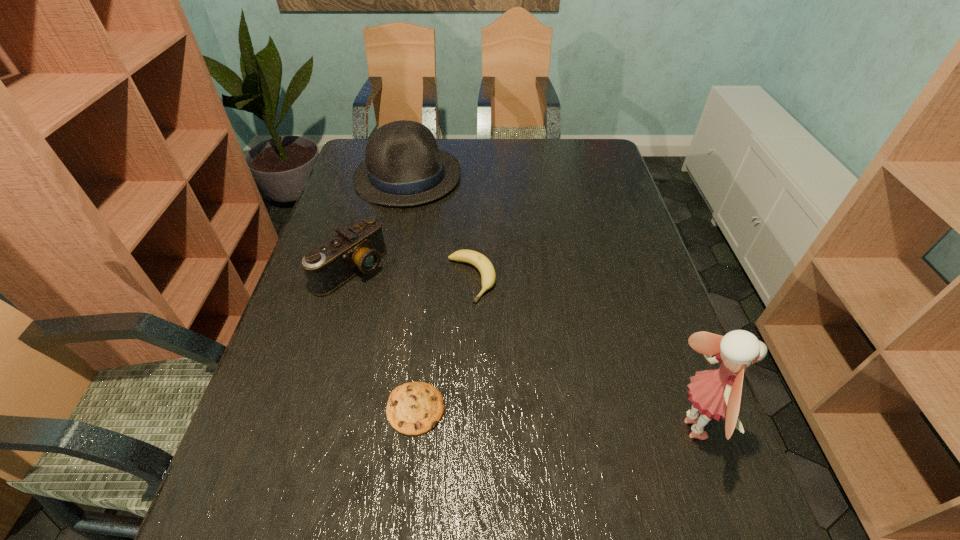
The height and width of the screenshot is (540, 960). In order to click on free space located 0.290m at the stem of the banana in this screenshot , I will do `click(546, 394)`.

This screenshot has height=540, width=960. In order to click on vacant space situated on the lens of the camera in this screenshot , I will do coord(451,340).

This screenshot has height=540, width=960. Identify the location of vacant space situated 0.070m on the lens of the camera. (392, 299).

You are a GUI agent. You are given a task and a screenshot of the screen. Output one action in this format:
    pyautogui.click(x=<x>, y=<y>)
    Task: Click on the free space located on the lens of the camera
    This screenshot has height=540, width=960.
    Given the screenshot: What is the action you would take?
    pyautogui.click(x=400, y=305)

At what (x,y) coordinates should I click in order to perform the action: click on vacant space positioned on the front-facing side of the second tallest object. Please return your answer as a coordinate pair (x, y). The width and height of the screenshot is (960, 540). Looking at the image, I should click on (457, 267).

Find the location of a particular element. The height and width of the screenshot is (540, 960). vacant region located on the front-facing side of the second tallest object is located at coordinates (455, 264).

Where is `vacant point located on the front-facing side of the second tallest object`? This screenshot has width=960, height=540. vacant point located on the front-facing side of the second tallest object is located at coordinates (438, 232).

Locate an element on the screen. object located at the far edge is located at coordinates (403, 167).

Locate an element on the screen. This screenshot has width=960, height=540. object that is positioned at the near edge is located at coordinates (716, 393).

Where is `camera that is at the left edge`? The height and width of the screenshot is (540, 960). camera that is at the left edge is located at coordinates (359, 248).